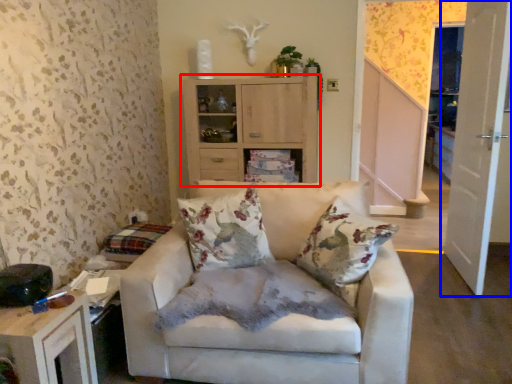
Question: Which of the following is the farthest to the observer, cabinetry (highlighted by a red box) or door (highlighted by a blue box)?

Choices:
 (A) cabinetry
 (B) door

Answer: (A)